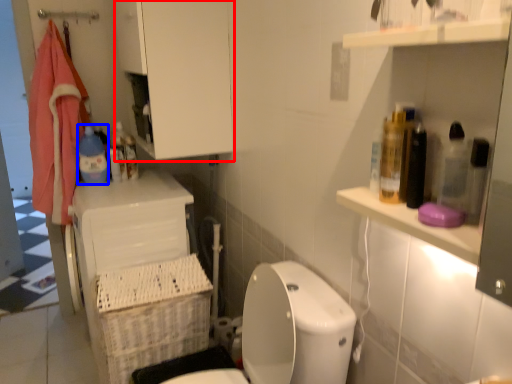
Question: Which object is further to the camera taking this photo, cabinetry (highlighted by a red box) or cleaning product (highlighted by a blue box)?

Choices:
 (A) cabinetry
 (B) cleaning product

Answer: (B)